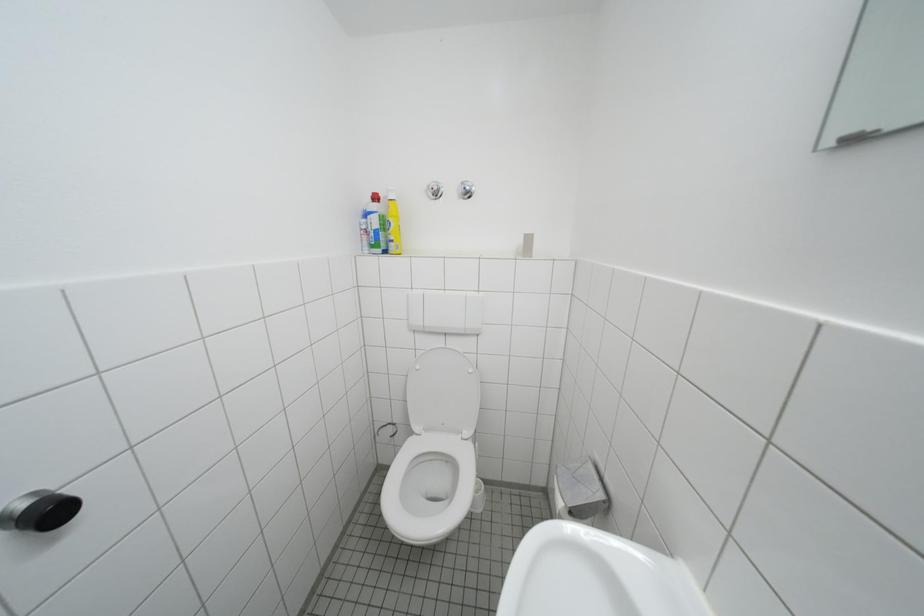
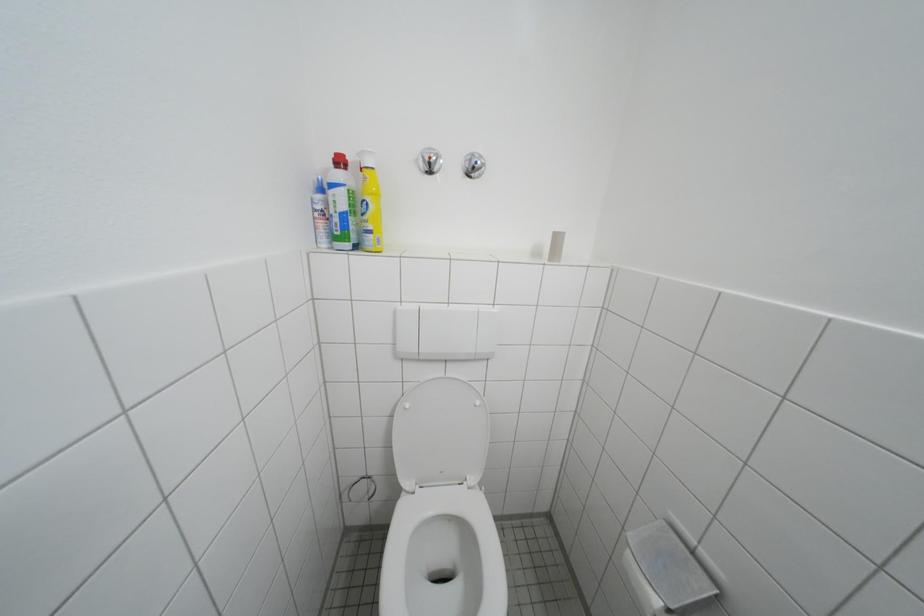
In a continuous first-person perspective shot, in which direction is the camera moving?

The cameraman walked toward left, forward.